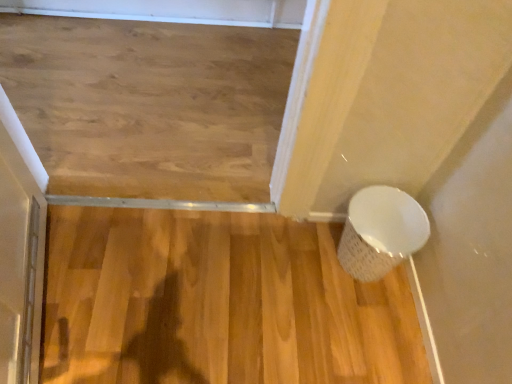
Question: Is the position of natural wood floor at center less distant than that of white textured basket at lower right?

Choices:
 (A) no
 (B) yes

Answer: (B)

Question: Is natural wood floor at center behind white textured basket at lower right?

Choices:
 (A) no
 (B) yes

Answer: (A)

Question: Is white textured basket at lower right a part of natural wood floor at center?

Choices:
 (A) yes
 (B) no

Answer: (B)

Question: Is natural wood floor at center taller than white textured basket at lower right?

Choices:
 (A) no
 (B) yes

Answer: (A)

Question: Considering the relative sizes of natural wood floor at center and white textured basket at lower right in the image provided, is natural wood floor at center bigger than white textured basket at lower right?

Choices:
 (A) yes
 (B) no

Answer: (A)

Question: Is natural wood floor at center positioned with its back to white textured basket at lower right?

Choices:
 (A) no
 (B) yes

Answer: (A)

Question: From a real-world perspective, is white textured basket at lower right below natural wood floor at center?

Choices:
 (A) no
 (B) yes

Answer: (A)

Question: Considering the relative positions of white textured basket at lower right and natural wood floor at center in the image provided, is white textured basket at lower right behind natural wood floor at center?

Choices:
 (A) no
 (B) yes

Answer: (B)

Question: Considering the relative sizes of white textured basket at lower right and natural wood floor at center in the image provided, is white textured basket at lower right wider than natural wood floor at center?

Choices:
 (A) yes
 (B) no

Answer: (B)

Question: Considering the relative positions of white textured basket at lower right and natural wood floor at center in the image provided, is white textured basket at lower right to the left of natural wood floor at center from the viewer's perspective?

Choices:
 (A) yes
 (B) no

Answer: (B)

Question: Is white textured basket at lower right shorter than natural wood floor at center?

Choices:
 (A) yes
 (B) no

Answer: (B)

Question: Does white textured basket at lower right contain natural wood floor at center?

Choices:
 (A) no
 (B) yes

Answer: (A)

Question: From the image's perspective, is white textured basket at lower right located above or below natural wood floor at center?

Choices:
 (A) above
 (B) below

Answer: (A)